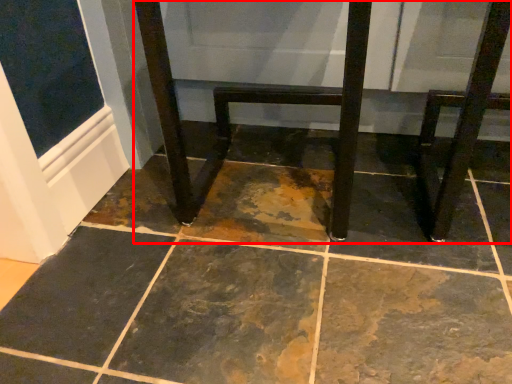
Question: From the image's perspective, where is furniture (annotated by the red box) located relative to step stool?

Choices:
 (A) below
 (B) above

Answer: (B)